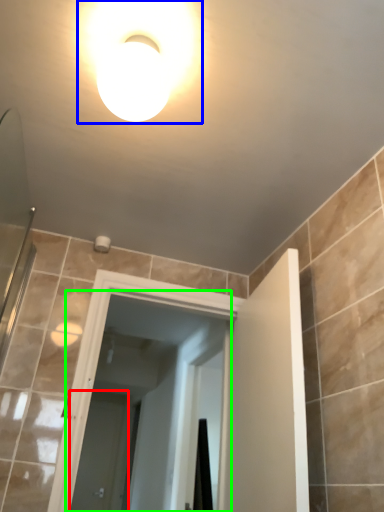
Question: Based on their relative distances, which object is farther from screen door (highlighted by a red box)? Choose from light fixture (highlighted by a blue box) and screen door (highlighted by a green box).

Choices:
 (A) light fixture
 (B) screen door

Answer: (A)